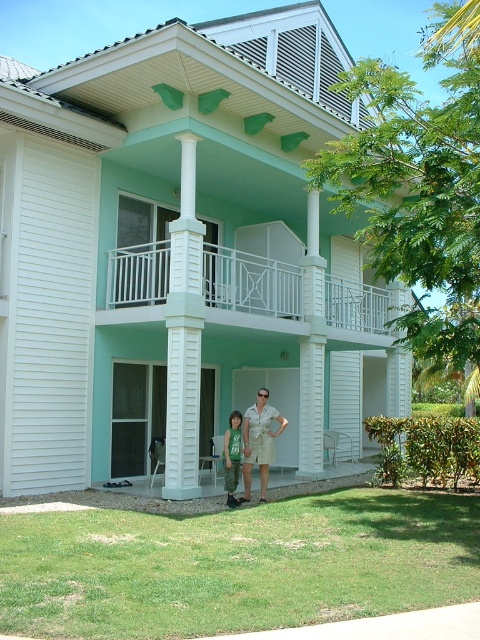
Is white painted wood column at center smaller than white smooth column at center?

No.

I want to click on white painted wood column at center, so click(x=183, y=336).

You are a GUI agent. You are given a task and a screenshot of the screen. Output one action in this format:
    pyautogui.click(x=<x>, y=<y>)
    Task: Click on the white painted wood column at center
    
    Given the screenshot: What is the action you would take?
    pyautogui.click(x=183, y=336)

Does point (313, 321) come farther from viewer compared to point (263, 477)?

Yes, point (313, 321) is behind point (263, 477).

Does white smooth column at center have a greater width compared to khaki shorts at center?

No.

Is point (310, 416) behind point (273, 419)?

Yes.

The height and width of the screenshot is (640, 480). What are the coordinates of `white smooth column at center` in the screenshot? It's located at (312, 348).

Consider the image. Does white matte balcony at upper center appear under white painted wood column at center?

No.

Who is shorter, white matte balcony at upper center or white painted wood column at center?

Standing shorter between the two is white matte balcony at upper center.

Is point (340, 282) farther from camera compared to point (194, 285)?

Yes, point (340, 282) is behind point (194, 285).

Identify the location of white matte balcony at upper center. (253, 289).